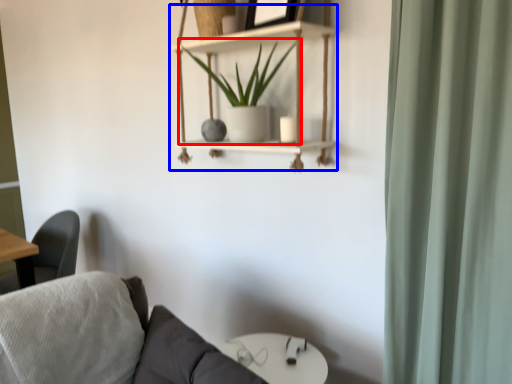
Question: Which point is further to the camera, houseplant (highlighted by a red box) or cabinet (highlighted by a blue box)?

Choices:
 (A) houseplant
 (B) cabinet

Answer: (A)